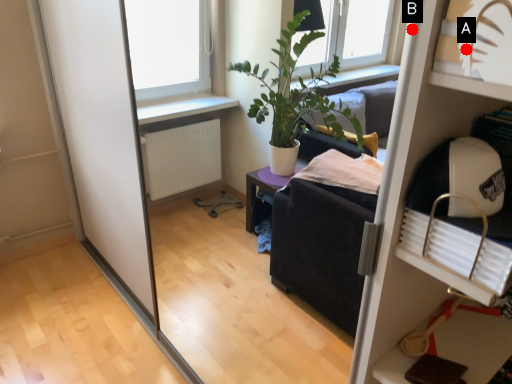
Question: Two points are circled on the image, labeled by A and B beside each circle. Among these points, which one is nearest to the camera?

Choices:
 (A) A is closer
 (B) B is closer

Answer: (A)